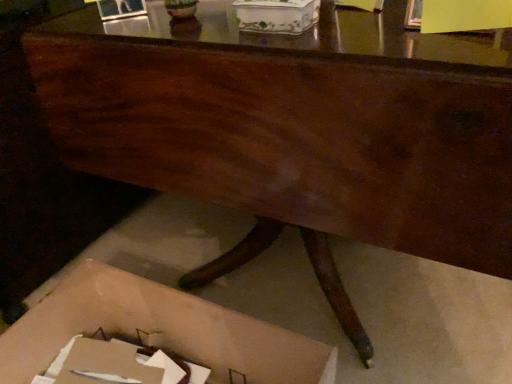
Find the location of a particular element. porcelain floral box at center, positioned as the second storage box in bottom-to-top order is located at coordinates (276, 15).

Describe the element at coordinates (276, 15) in the screenshot. I see `porcelain floral box at center, marked as the first storage box in a top-to-bottom arrangement` at that location.

In order to face porcelain floral box at center, marked as the first storage box in a top-to-bottom arrangement, should I rotate leftwards or rightwards?

Rotate your view right by about 2.393°.

The image size is (512, 384). Describe the element at coordinates (160, 331) in the screenshot. I see `cardboard box at lower center, the 2th storage box from the top` at that location.

Measure the distance between cardboard box at lower center, the 2th storage box from the top, and camera.

29.76 inches.

Locate an element on the screen. Image resolution: width=512 pixels, height=384 pixels. cardboard box at lower center, the 2th storage box from the top is located at coordinates (160, 331).

The height and width of the screenshot is (384, 512). I want to click on porcelain floral box at center, marked as the first storage box in a top-to-bottom arrangement, so click(x=276, y=15).

Is cardboard box at lower center, which ranks as the first storage box in bottom-to-top order, to the right of porcelain floral box at center, positioned as the second storage box in bottom-to-top order, from the viewer's perspective?

In fact, cardboard box at lower center, which ranks as the first storage box in bottom-to-top order, is to the left of porcelain floral box at center, positioned as the second storage box in bottom-to-top order.

Who is more distant, cardboard box at lower center, which ranks as the first storage box in bottom-to-top order, or porcelain floral box at center, marked as the first storage box in a top-to-bottom arrangement?

Positioned behind is porcelain floral box at center, marked as the first storage box in a top-to-bottom arrangement.

Which point is more forward, (46, 311) or (286, 30)?

The point (286, 30) is closer.

Consider the image. From the image's perspective, which is below, cardboard box at lower center, the 2th storage box from the top, or porcelain floral box at center, marked as the first storage box in a top-to-bottom arrangement?

cardboard box at lower center, the 2th storage box from the top, from the image's perspective.

From a real-world perspective, is cardboard box at lower center, which ranks as the first storage box in bottom-to-top order, on top of porcelain floral box at center, marked as the first storage box in a top-to-bottom arrangement?

No.

Does cardboard box at lower center, the 2th storage box from the top, have a greater width compared to porcelain floral box at center, positioned as the second storage box in bottom-to-top order?

Yes, cardboard box at lower center, the 2th storage box from the top, is wider than porcelain floral box at center, positioned as the second storage box in bottom-to-top order.

Does cardboard box at lower center, the 2th storage box from the top, have a lesser height compared to porcelain floral box at center, marked as the first storage box in a top-to-bottom arrangement?

Incorrect, the height of cardboard box at lower center, the 2th storage box from the top, does not fall short of that of porcelain floral box at center, marked as the first storage box in a top-to-bottom arrangement.

Can you confirm if cardboard box at lower center, the 2th storage box from the top, is smaller than porcelain floral box at center, positioned as the second storage box in bottom-to-top order?

Actually, cardboard box at lower center, the 2th storage box from the top, might be larger than porcelain floral box at center, positioned as the second storage box in bottom-to-top order.

Is cardboard box at lower center, which ranks as the first storage box in bottom-to-top order, completely or partially outside of porcelain floral box at center, positioned as the second storage box in bottom-to-top order?

Yes, cardboard box at lower center, which ranks as the first storage box in bottom-to-top order, is outside of porcelain floral box at center, positioned as the second storage box in bottom-to-top order.

Is cardboard box at lower center, the 2th storage box from the top, with porcelain floral box at center, marked as the first storage box in a top-to-bottom arrangement?

There is a gap between cardboard box at lower center, the 2th storage box from the top, and porcelain floral box at center, marked as the first storage box in a top-to-bottom arrangement.

Is cardboard box at lower center, the 2th storage box from the top, turned away from porcelain floral box at center, positioned as the second storage box in bottom-to-top order?

No, porcelain floral box at center, positioned as the second storage box in bottom-to-top order, is not at the back of cardboard box at lower center, the 2th storage box from the top.

The width and height of the screenshot is (512, 384). Find the location of `storage box located behind the cardboard box at lower center, which ranks as the first storage box in bottom-to-top order`. storage box located behind the cardboard box at lower center, which ranks as the first storage box in bottom-to-top order is located at coordinates (276, 15).

Which object is positioned more to the left, porcelain floral box at center, marked as the first storage box in a top-to-bottom arrangement, or cardboard box at lower center, the 2th storage box from the top?

cardboard box at lower center, the 2th storage box from the top, is more to the left.

Considering their positions, is porcelain floral box at center, positioned as the second storage box in bottom-to-top order, located in front of or behind cardboard box at lower center, the 2th storage box from the top?

In the image, porcelain floral box at center, positioned as the second storage box in bottom-to-top order, appears behind cardboard box at lower center, the 2th storage box from the top.

Is point (298, 6) closer or farther from the camera than point (110, 276)?

Point (298, 6) appears to be closer to the viewer than point (110, 276).

From the image's perspective, which one is positioned higher, porcelain floral box at center, positioned as the second storage box in bottom-to-top order, or cardboard box at lower center, the 2th storage box from the top?

porcelain floral box at center, positioned as the second storage box in bottom-to-top order, is shown above in the image.

From a real-world perspective, who is located lower, porcelain floral box at center, positioned as the second storage box in bottom-to-top order, or cardboard box at lower center, the 2th storage box from the top?

cardboard box at lower center, the 2th storage box from the top, from a real-world perspective.

Between porcelain floral box at center, marked as the first storage box in a top-to-bottom arrangement, and cardboard box at lower center, the 2th storage box from the top, which one has smaller width?

Thinner between the two is porcelain floral box at center, marked as the first storage box in a top-to-bottom arrangement.

Can you confirm if porcelain floral box at center, positioned as the second storage box in bottom-to-top order, is taller than cardboard box at lower center, which ranks as the first storage box in bottom-to-top order?

Incorrect, the height of porcelain floral box at center, positioned as the second storage box in bottom-to-top order, is not larger of that of cardboard box at lower center, which ranks as the first storage box in bottom-to-top order.

Is porcelain floral box at center, positioned as the second storage box in bottom-to-top order, bigger than cardboard box at lower center, which ranks as the first storage box in bottom-to-top order?

Incorrect, porcelain floral box at center, positioned as the second storage box in bottom-to-top order, is not larger than cardboard box at lower center, which ranks as the first storage box in bottom-to-top order.

Is porcelain floral box at center, marked as the first storage box in a top-to-bottom arrangement, inside or outside of cardboard box at lower center, which ranks as the first storage box in bottom-to-top order?

porcelain floral box at center, marked as the first storage box in a top-to-bottom arrangement, exists outside the volume of cardboard box at lower center, which ranks as the first storage box in bottom-to-top order.

Is porcelain floral box at center, positioned as the second storage box in bottom-to-top order, with cardboard box at lower center, the 2th storage box from the top?

There is a gap between porcelain floral box at center, positioned as the second storage box in bottom-to-top order, and cardboard box at lower center, the 2th storage box from the top.

Looking at this image, could you tell me if porcelain floral box at center, positioned as the second storage box in bottom-to-top order, is turned towards cardboard box at lower center, which ranks as the first storage box in bottom-to-top order?

No, porcelain floral box at center, positioned as the second storage box in bottom-to-top order, does not turn towards cardboard box at lower center, which ranks as the first storage box in bottom-to-top order.

Can you tell me how much porcelain floral box at center, marked as the first storage box in a top-to-bottom arrangement, and cardboard box at lower center, the 2th storage box from the top, differ in facing direction?

The angle between the facing direction of porcelain floral box at center, marked as the first storage box in a top-to-bottom arrangement, and the facing direction of cardboard box at lower center, the 2th storage box from the top, is 89.8 degrees.

How far apart are porcelain floral box at center, marked as the first storage box in a top-to-bottom arrangement, and cardboard box at lower center, which ranks as the first storage box in bottom-to-top order?

porcelain floral box at center, marked as the first storage box in a top-to-bottom arrangement, and cardboard box at lower center, which ranks as the first storage box in bottom-to-top order, are 64.24 centimeters apart from each other.

You are a GUI agent. You are given a task and a screenshot of the screen. Output one action in this format:
    pyautogui.click(x=<x>, y=<y>)
    Task: Click on the storage box in front of the porcelain floral box at center, positioned as the second storage box in bottom-to-top order
    This screenshot has width=512, height=384.
    Given the screenshot: What is the action you would take?
    pyautogui.click(x=160, y=331)

Identify the location of storage box behind the cardboard box at lower center, which ranks as the first storage box in bottom-to-top order. (276, 15).

Find the location of a particular element. storage box below the porcelain floral box at center, positioned as the second storage box in bottom-to-top order (from the image's perspective) is located at coordinates (160, 331).